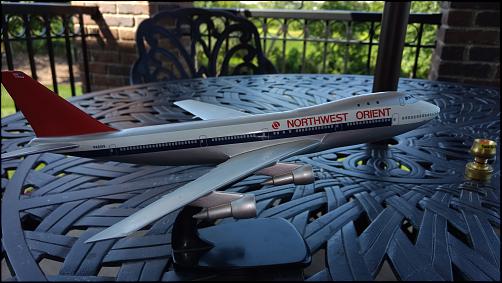
Identify the location of brick wall. Image resolution: width=502 pixels, height=283 pixels. click(493, 20), click(473, 65), click(118, 72), click(130, 20).